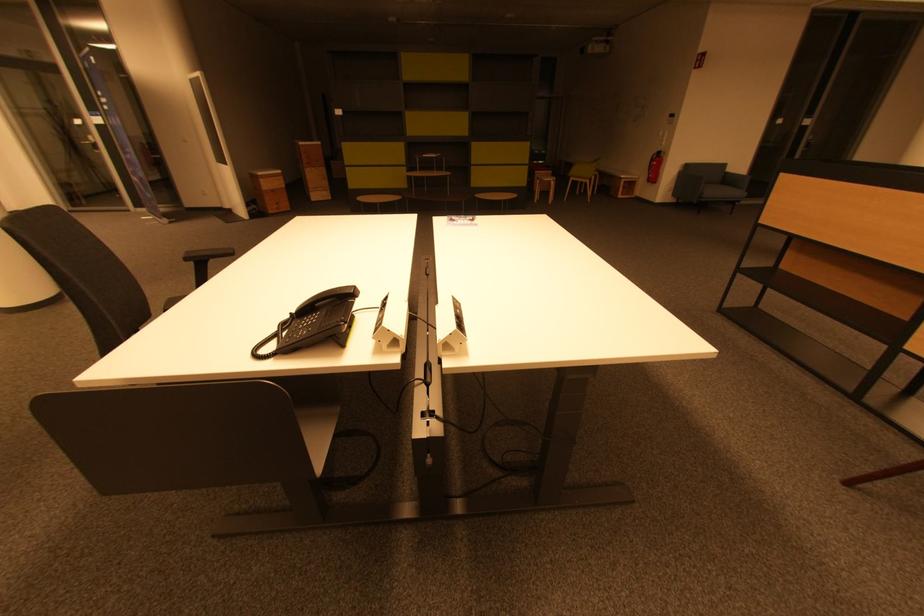
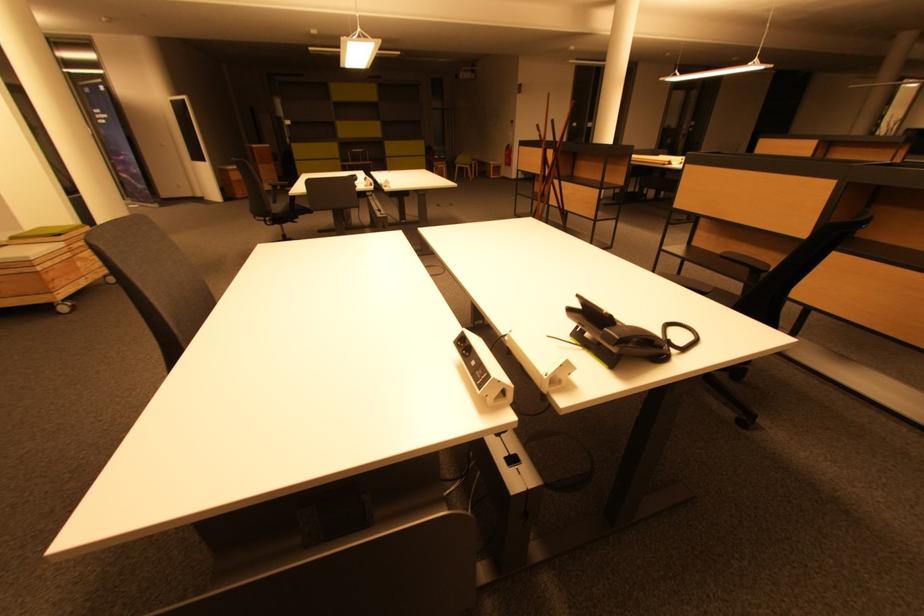
The point at (660, 164) is marked in the first image. Where is the corresponding point in the second image?

(512, 155)